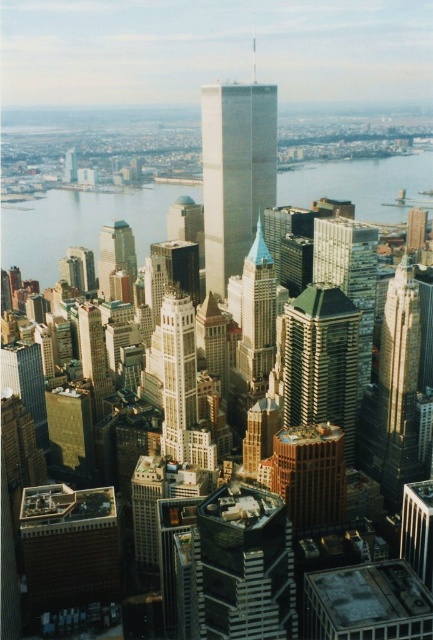
Is white glass tower at center below gold reflective building at center?

Actually, white glass tower at center is above gold reflective building at center.

Can you confirm if white glass tower at center is smaller than gold reflective building at center?

No.

Who is more distant from viewer, (249, 116) or (368, 260)?

Positioned behind is point (249, 116).

Find the location of a particular element. white glass tower at center is located at coordinates (235, 172).

Based on the photo, does gold reflective tower at center have a greater width compared to matte glass skyscraper at center-left?

Yes.

Who is more forward, (320, 467) or (106, 228)?

Point (106, 228)

Who is more distant from viewer, (316, 477) or (102, 246)?

The point (316, 477) is more distant.

Find the location of a particular element. gold reflective tower at center is located at coordinates (310, 474).

Based on the photo, who is higher up, white marble skyscraper at center or matte glass skyscraper at center-left?

matte glass skyscraper at center-left

Does white marble skyscraper at center have a greater width compared to matte glass skyscraper at center-left?

No.

Which is in front, point (174, 404) or point (132, 237)?

Point (174, 404) is in front.

This screenshot has height=640, width=433. I want to click on white marble skyscraper at center, so click(177, 372).